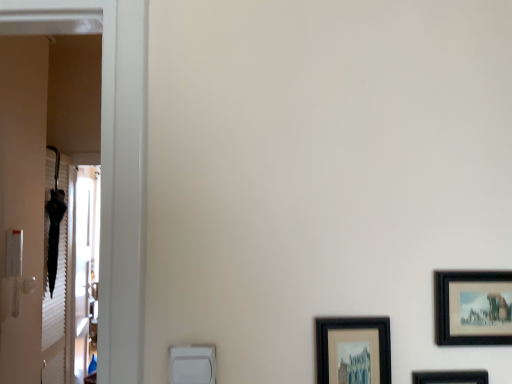
Question: Is black matte picture frame at lower right, which is the 1th picture frame from left to right, a part of black matte picture frame at right, which is the 1th picture frame in right-to-left order?

Choices:
 (A) yes
 (B) no

Answer: (B)

Question: Does black matte picture frame at right, arranged as the third picture frame when viewed from the left, have a greater height compared to black matte picture frame at lower right, which is the 1th picture frame from left to right?

Choices:
 (A) yes
 (B) no

Answer: (B)

Question: Is there a large distance between black matte picture frame at right, arranged as the third picture frame when viewed from the left, and black matte picture frame at lower right, which is the 1th picture frame from left to right?

Choices:
 (A) yes
 (B) no

Answer: (B)

Question: Is black matte picture frame at right, which is the 1th picture frame in right-to-left order, positioned behind black matte picture frame at lower right, the 3th picture frame viewed from the right?

Choices:
 (A) no
 (B) yes

Answer: (B)

Question: From the image's perspective, is black matte picture frame at right, which is the 1th picture frame in right-to-left order, below black matte picture frame at lower right, which is the 1th picture frame from left to right?

Choices:
 (A) no
 (B) yes

Answer: (A)

Question: Is black matte picture frame at right, arranged as the third picture frame when viewed from the left, wider than black matte picture frame at lower right, the 3th picture frame viewed from the right?

Choices:
 (A) no
 (B) yes

Answer: (A)

Question: Is clear glass screen door at left at the right side of black matte picture frame at right, which is the 1th picture frame in right-to-left order?

Choices:
 (A) yes
 (B) no

Answer: (B)

Question: Is clear glass screen door at left far away from black matte picture frame at right, arranged as the third picture frame when viewed from the left?

Choices:
 (A) no
 (B) yes

Answer: (B)

Question: Can you confirm if clear glass screen door at left is smaller than black matte picture frame at right, arranged as the third picture frame when viewed from the left?

Choices:
 (A) yes
 (B) no

Answer: (B)

Question: Does clear glass screen door at left come in front of black matte picture frame at right, arranged as the third picture frame when viewed from the left?

Choices:
 (A) yes
 (B) no

Answer: (B)

Question: Considering the relative sizes of clear glass screen door at left and black matte picture frame at right, which is the 1th picture frame in right-to-left order, in the image provided, is clear glass screen door at left thinner than black matte picture frame at right, which is the 1th picture frame in right-to-left order,?

Choices:
 (A) yes
 (B) no

Answer: (B)

Question: Is clear glass screen door at left wider than black matte picture frame at right, which is the 1th picture frame in right-to-left order?

Choices:
 (A) yes
 (B) no

Answer: (A)

Question: Could you tell me if black matte picture frame at lower right, the 3th picture frame viewed from the right, is facing clear glass screen door at left?

Choices:
 (A) yes
 (B) no

Answer: (B)